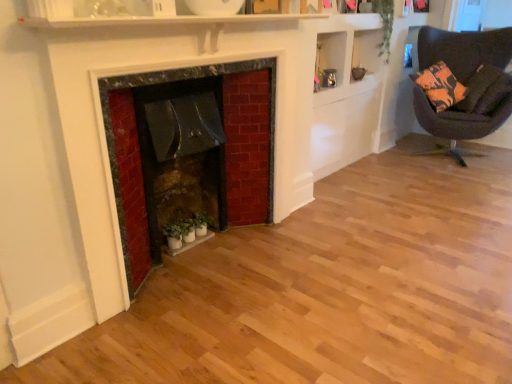
Question: Does rustic stone fireplace at center have a lesser width compared to green matte plant at lower center, which appears as the second plant when viewed from the right?

Choices:
 (A) no
 (B) yes

Answer: (A)

Question: Does rustic stone fireplace at center appear on the left side of green matte plant at lower center, which appears as the second plant when viewed from the right?

Choices:
 (A) no
 (B) yes

Answer: (B)

Question: Does rustic stone fireplace at center come behind green matte plant at lower center, which appears as the second plant when viewed from the right?

Choices:
 (A) no
 (B) yes

Answer: (A)

Question: Are rustic stone fireplace at center and green matte plant at lower center, which appears as the second plant when viewed from the right, located far from each other?

Choices:
 (A) yes
 (B) no

Answer: (B)

Question: Would you say rustic stone fireplace at center is outside green matte plant at lower center, the first plant in the left-to-right sequence?

Choices:
 (A) yes
 (B) no

Answer: (A)

Question: Looking at their shapes, would you say orange-patterned fabric pillow at upper right is wider or thinner than dark brown fabric chair at right?

Choices:
 (A) wide
 (B) thin

Answer: (B)

Question: Based on their sizes in the image, would you say orange-patterned fabric pillow at upper right is bigger or smaller than dark brown fabric chair at right?

Choices:
 (A) big
 (B) small

Answer: (B)

Question: From a real-world perspective, is orange-patterned fabric pillow at upper right above or below dark brown fabric chair at right?

Choices:
 (A) below
 (B) above

Answer: (B)

Question: Considering the positions of orange-patterned fabric pillow at upper right and dark brown fabric chair at right in the image, is orange-patterned fabric pillow at upper right taller or shorter than dark brown fabric chair at right?

Choices:
 (A) short
 (B) tall

Answer: (A)

Question: Considering the positions of green leafy plant at upper right, which is counted as the first plant, starting from the top, and orange-patterned fabric pillow at upper right in the image, is green leafy plant at upper right, which is counted as the first plant, starting from the top, taller or shorter than orange-patterned fabric pillow at upper right?

Choices:
 (A) short
 (B) tall

Answer: (B)

Question: From the image's perspective, is green leafy plant at upper right, which is the second plant in bottom-to-top order, above or below orange-patterned fabric pillow at upper right?

Choices:
 (A) below
 (B) above

Answer: (B)

Question: Is point (385, 0) positioned closer to the camera than point (486, 97)?

Choices:
 (A) farther
 (B) closer

Answer: (B)

Question: Based on their sizes in the image, would you say green leafy plant at upper right, which is the second plant in bottom-to-top order, is bigger or smaller than orange-patterned fabric pillow at upper right?

Choices:
 (A) small
 (B) big

Answer: (A)

Question: In the image, is orange-patterned fabric pillow at upper right positioned in front of or behind rustic stone fireplace at center?

Choices:
 (A) front
 (B) behind

Answer: (B)

Question: Would you say orange-patterned fabric pillow at upper right is to the left or to the right of rustic stone fireplace at center in the picture?

Choices:
 (A) left
 (B) right

Answer: (B)